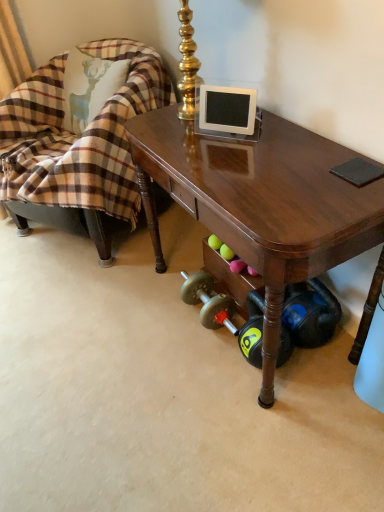
At what (x,y) coordinates should I click in order to perform the action: click on blank space situated above shiny brown desk at center (from a real-world perspective). Please return your answer as a coordinate pair (x, y). Image resolution: width=384 pixels, height=512 pixels. Looking at the image, I should click on (263, 153).